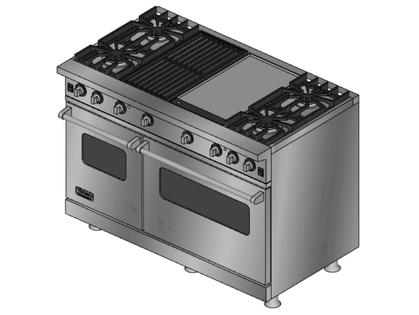
The image size is (419, 315). What are the coordinates of `left front hob plate` in the screenshot? It's located at click(111, 53).